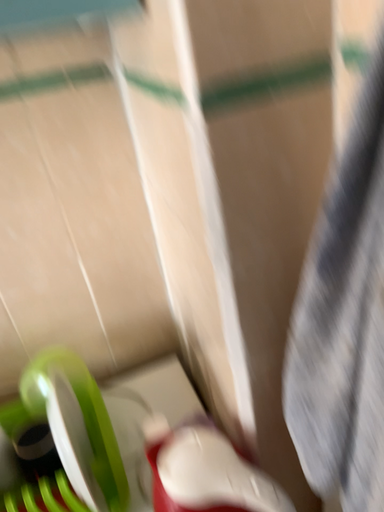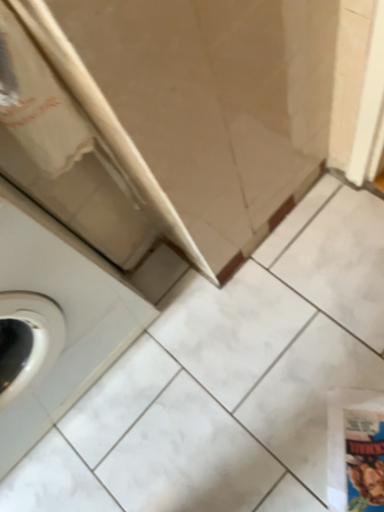
Question: How did the camera likely rotate when shooting the video?

Choices:
 (A) rotated upward
 (B) rotated downward

Answer: (B)